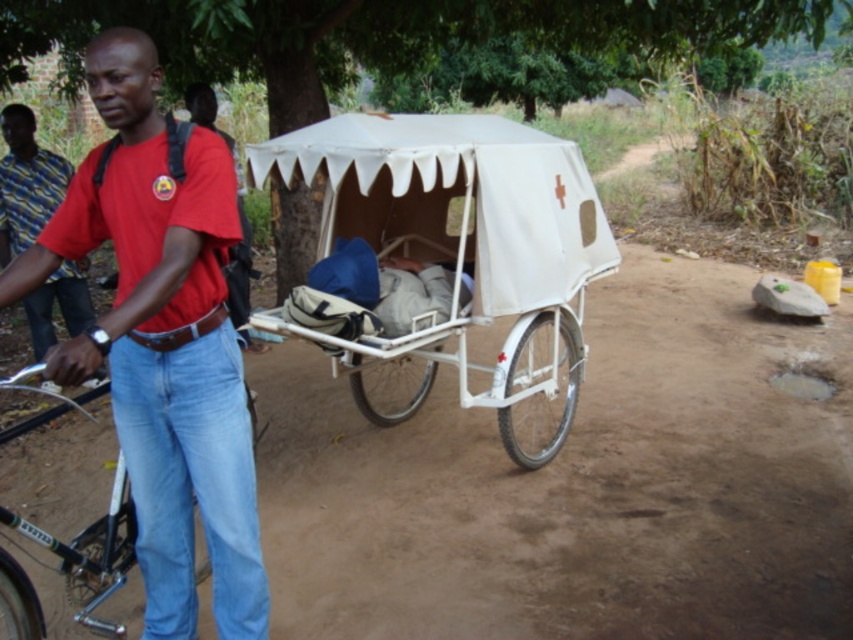
Based on the scene, which object is positioned higher relative to the other? The white matte wagon at center or the red cotton shirt at left?

The white matte wagon at center is positioned higher than the red cotton shirt at left.